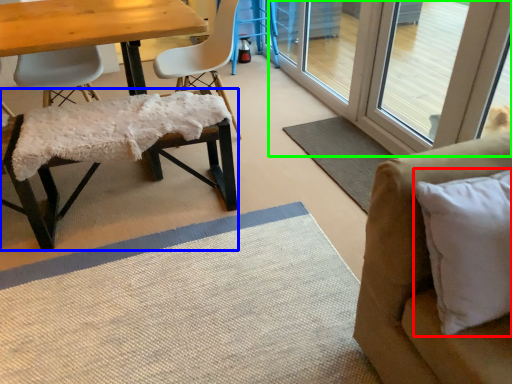
Question: Which object is the closest to the pillow (highlighted by a red box)? Choose among these: chair (highlighted by a blue box) or screen door (highlighted by a green box).

Choices:
 (A) chair
 (B) screen door

Answer: (A)